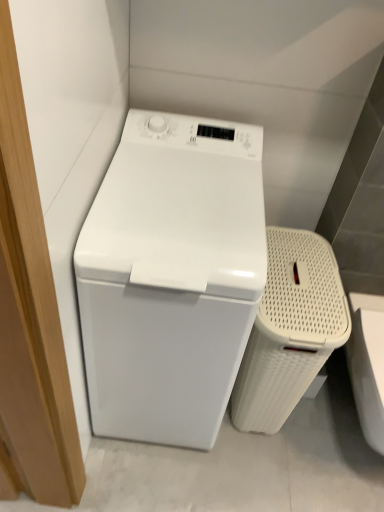
Locate an element on the screen. The width and height of the screenshot is (384, 512). vacant space that is in between white glossy washing machine at left and white woven laundry basket at right is located at coordinates (244, 451).